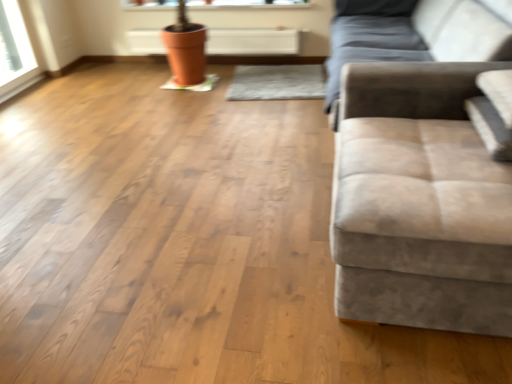
Question: Would you say orange clay pot at upper center is to the left or to the right of white glossy window sill at upper center in the picture?

Choices:
 (A) right
 (B) left

Answer: (A)

Question: Considering the positions of orange clay pot at upper center and white glossy window sill at upper center in the image, is orange clay pot at upper center bigger or smaller than white glossy window sill at upper center?

Choices:
 (A) big
 (B) small

Answer: (A)

Question: Which object is positioned farthest from the suede-like beige studio couch at right?

Choices:
 (A) orange clay pot at upper center
 (B) white glossy window sill at upper center

Answer: (B)

Question: Which is farther from the suede-like beige studio couch at right?

Choices:
 (A) orange clay pot at upper center
 (B) white glossy window sill at upper center

Answer: (B)